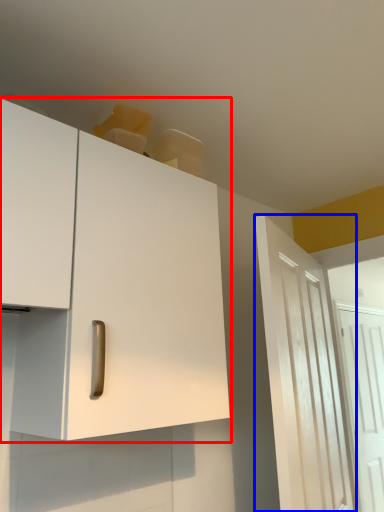
Question: Which of the following is the farthest to the observer, cabinetry (highlighted by a red box) or door (highlighted by a blue box)?

Choices:
 (A) cabinetry
 (B) door

Answer: (B)